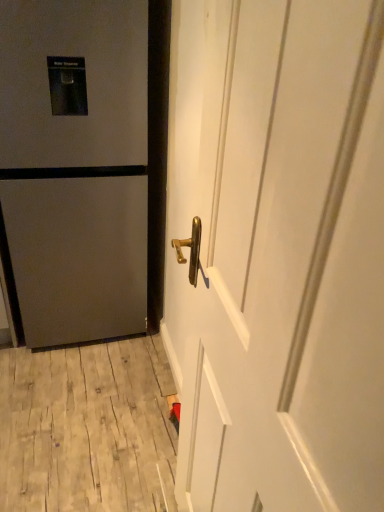
Question: Is the depth of wooden at lower left greater than that of white glossy door handle at center, placed as the 1th door when sorted from front to back?

Choices:
 (A) no
 (B) yes

Answer: (B)

Question: Can you confirm if wooden at lower left is wider than white glossy door handle at center, acting as the second door starting from the back?

Choices:
 (A) no
 (B) yes

Answer: (B)

Question: Can white glossy door handle at center, which appears as the first door when viewed from the right, be found inside wooden at lower left?

Choices:
 (A) no
 (B) yes

Answer: (A)

Question: From a real-world perspective, is wooden at lower left physically below white glossy door handle at center, placed as the 1th door when sorted from front to back?

Choices:
 (A) yes
 (B) no

Answer: (A)

Question: Is wooden at lower left not close to white glossy door handle at center, placed as the 1th door when sorted from front to back?

Choices:
 (A) no
 (B) yes

Answer: (A)

Question: Can you confirm if wooden at lower left is shorter than white glossy door handle at center, which is counted as the 2th door, starting from the left?

Choices:
 (A) no
 (B) yes

Answer: (B)

Question: Could you tell me if matte gray refrigerator at left, the 2th door from the right, is turned towards white glossy door handle at center, which is counted as the 2th door, starting from the left?

Choices:
 (A) no
 (B) yes

Answer: (B)

Question: Is matte gray refrigerator at left, the 2th door from the right, positioned behind white glossy door handle at center, which is counted as the 2th door, starting from the left?

Choices:
 (A) no
 (B) yes

Answer: (B)

Question: Is matte gray refrigerator at left, the 2th door from the right, surrounding white glossy door handle at center, which appears as the first door when viewed from the right?

Choices:
 (A) no
 (B) yes

Answer: (A)

Question: Does matte gray refrigerator at left, the second door positioned from the front, have a greater width compared to white glossy door handle at center, placed as the 1th door when sorted from front to back?

Choices:
 (A) no
 (B) yes

Answer: (B)

Question: Is there a large distance between matte gray refrigerator at left, the first door viewed from the left, and white glossy door handle at center, placed as the 1th door when sorted from front to back?

Choices:
 (A) yes
 (B) no

Answer: (B)

Question: Can you confirm if matte gray refrigerator at left, the second door positioned from the front, is bigger than white glossy door handle at center, acting as the second door starting from the back?

Choices:
 (A) no
 (B) yes

Answer: (B)

Question: From the image's perspective, would you say matte gray refrigerator at left, the first door viewed from the left, is shown under wooden at lower left?

Choices:
 (A) yes
 (B) no

Answer: (B)